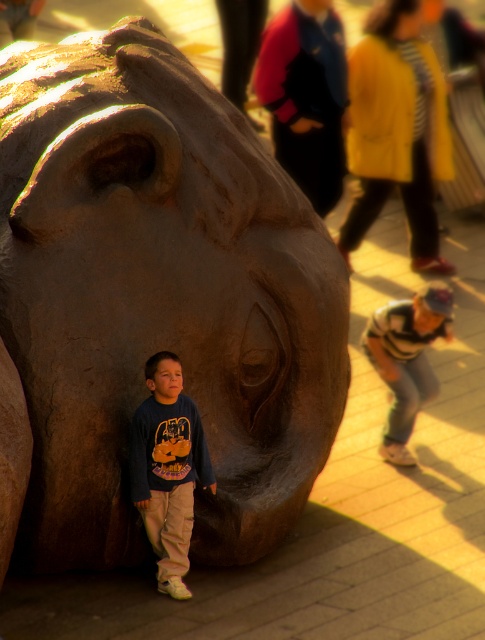
Which of these two, bronze statue at lower left or dark blue sweatshirt at lower left, stands shorter?

With less height is dark blue sweatshirt at lower left.

Who is higher up, bronze statue at lower left or dark blue sweatshirt at lower left?

bronze statue at lower left is higher up.

Between point (256, 435) and point (145, 467), which one is positioned in front?

Point (145, 467)

Where is `bronze statue at lower left`? The height and width of the screenshot is (640, 485). bronze statue at lower left is located at coordinates (158, 298).

Does bronze statue at lower left have a larger size compared to striped sweater at lower right?

Yes.

Does bronze statue at lower left come in front of striped sweater at lower right?

Yes, bronze statue at lower left is closer to the viewer.

This screenshot has width=485, height=640. What are the coordinates of `bronze statue at lower left` in the screenshot? It's located at (158, 298).

Who is positioned more to the right, dark blue sweatshirt at lower left or striped sweater at lower right?

Positioned to the right is striped sweater at lower right.

Between point (149, 376) and point (420, 356), which one is positioned in front?

Point (149, 376) is more forward.

What do you see at coordinates (167, 468) in the screenshot?
I see `dark blue sweatshirt at lower left` at bounding box center [167, 468].

Locate an element on the screen. dark blue sweatshirt at lower left is located at coordinates (167, 468).